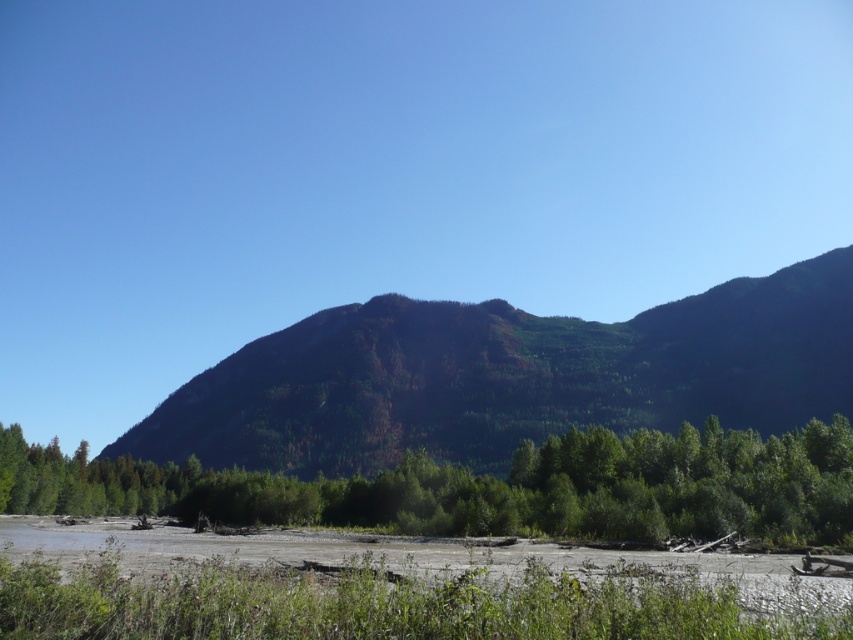
Based on the scene description and the coordinates provided, can you identify which object corresponds to the point at coordinates (509, 376)?

The point at coordinates (509, 376) corresponds to the green forested mountain at center.

You are planning to plant a new row of trees along the riverbank. The space allocated for the trees is the same width as the green leafy trees at lower center. Can the green forested mountain at center fit into this space?

The green forested mountain at center is wider than the green leafy trees at lower center, so it cannot fit into the space allocated for the trees which is the same width as the green leafy trees at lower center.

You are planning to hike from the green leafy trees at lower center towards the green forested mountain at center. Which object will you encounter first?

You will encounter the green leafy trees at lower center first because they are closer to your starting position than the green forested mountain at center.